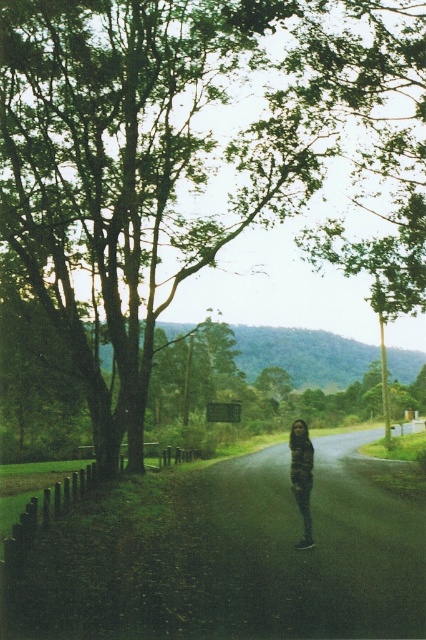
You are a delivery driver who needs to park your car on the dark asphalt road at center. However, there is a dark brown leather jacket at center in the way. Can you park your car there without moving the jacket?

The dark asphalt road at center has a larger size compared to the dark brown leather jacket at center, so there is enough space to park the car without moving the jacket.

You are a pedestrian standing on the dark asphalt road at center. You want to walk to the green leafy tree at center. Is the tree directly above the road where you are standing?

The green leafy tree at center is positioned over dark asphalt road at center, so yes, the tree is directly above the road where you are standing.

You are a delivery person standing on the dark asphalt road at center. You see the dark brown leather jacket at center in front of you. Can you step onto the jacket without stepping off the road?

The dark asphalt road at center is positioned under dark brown leather jacket at center, so stepping onto the jacket would require stepping off the road since the jacket is above the road.